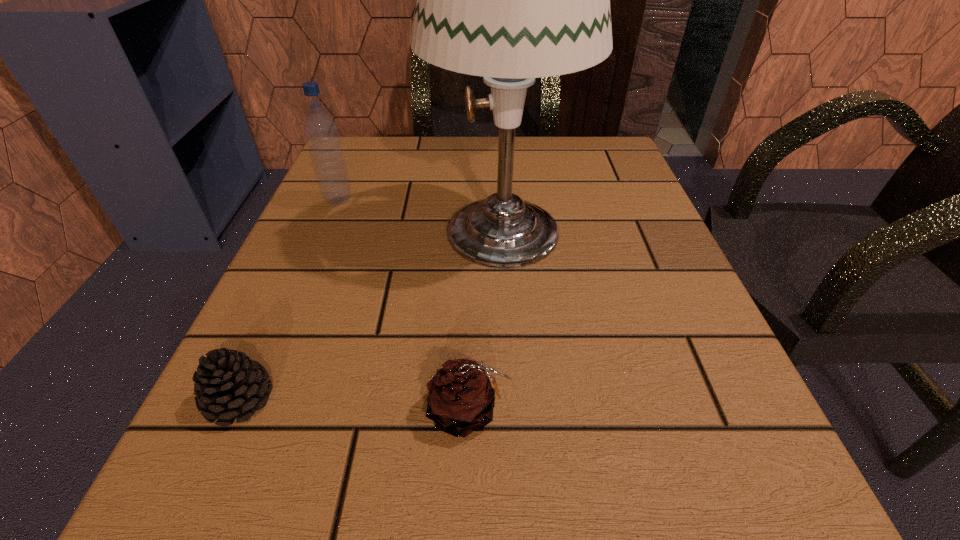
At what (x,y) coordinates should I click in order to perform the action: click on free spot between the lampshade and the left pinecone. Please return your answer as a coordinate pair (x, y). This screenshot has width=960, height=540. Looking at the image, I should click on click(372, 315).

Identify which object is the closest to the left pinecone. Please provide its 2D coordinates. Your answer should be formatted as a tuple, i.e. [(x, y)], where the tuple contains the x and y coordinates of a point satisfying the conditions above.

[(461, 399)]

Identify which object is the third closest to the left pinecone. Please provide its 2D coordinates. Your answer should be formatted as a tuple, i.e. [(x, y)], where the tuple contains the x and y coordinates of a point satisfying the conditions above.

[(321, 131)]

Find the location of `vacant region that satisfies the following two spatial constraints: 1. on the lampshade of the tallest object; 2. at the narrow end of the left pinecone`. vacant region that satisfies the following two spatial constraints: 1. on the lampshade of the tallest object; 2. at the narrow end of the left pinecone is located at coordinates (514, 400).